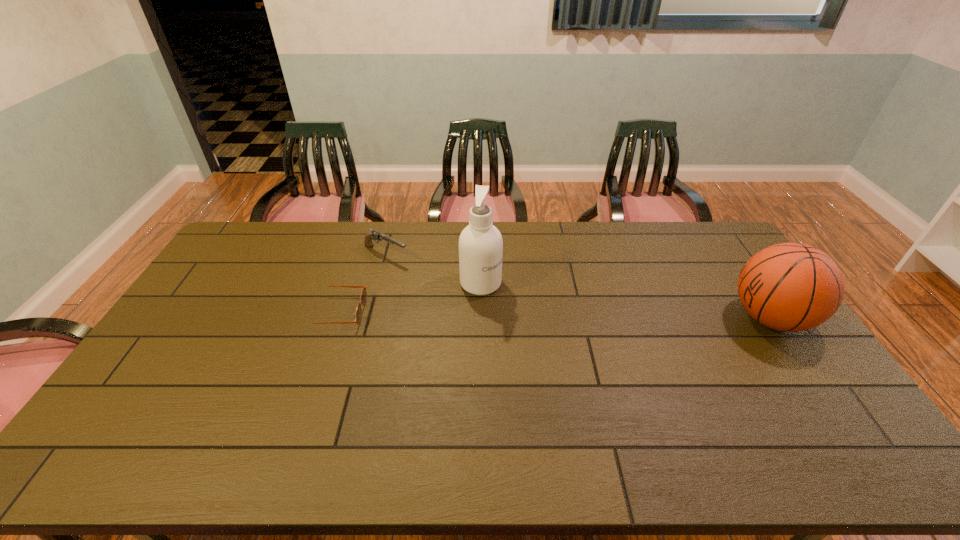
Locate an element on the screen. The height and width of the screenshot is (540, 960). vacant space at the right edge of the desktop is located at coordinates (792, 334).

Where is `vacant space at the far left corner of the desktop`? vacant space at the far left corner of the desktop is located at coordinates (226, 257).

The image size is (960, 540). In order to click on vacant area at the far right corner in this screenshot , I will do `click(692, 225)`.

Locate an element on the screen. free location at the near right corner of the desktop is located at coordinates (852, 416).

Identify the location of free spot between the farthest object and the second object from right to left. (433, 268).

In order to click on free point between the tallest object and the sunglasses in this screenshot , I will do `click(409, 298)`.

At what (x,y) coordinates should I click in order to perform the action: click on vacant area that lies between the tallest object and the rightmost object. Please return your answer as a coordinate pair (x, y). Looking at the image, I should click on (625, 301).

Locate an element on the screen. The width and height of the screenshot is (960, 540). blank region between the tallest object and the third shortest object is located at coordinates (625, 301).

You are a GUI agent. You are given a task and a screenshot of the screen. Output one action in this format:
    pyautogui.click(x=<x>, y=<y>)
    Task: Click on the free area in between the rightmost object and the tallest object
    The width and height of the screenshot is (960, 540).
    Given the screenshot: What is the action you would take?
    pyautogui.click(x=625, y=301)

The image size is (960, 540). What are the coordinates of `vacant region between the tallest object and the farthest object` in the screenshot? It's located at (433, 268).